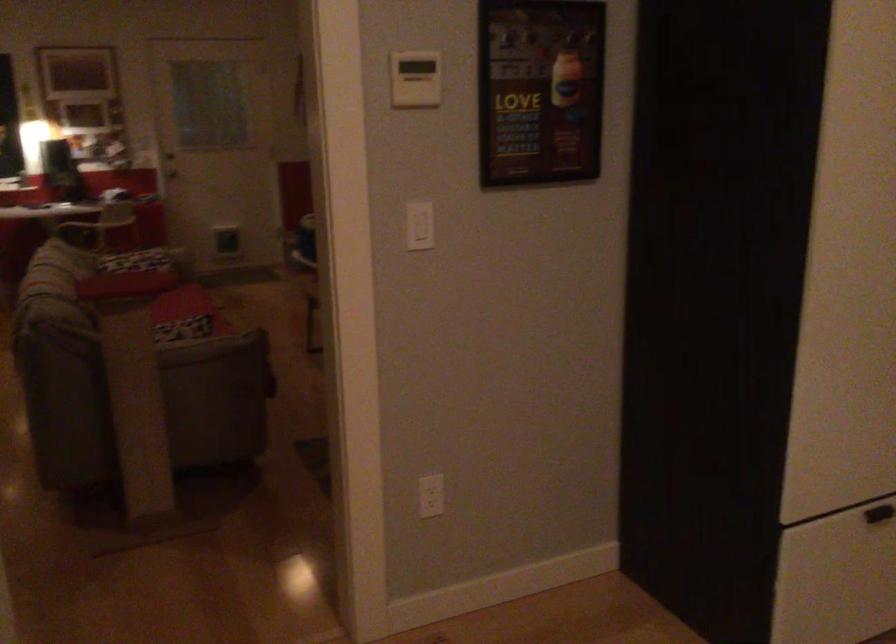
This screenshot has height=644, width=896. Find the location of `chair sitting surface`. chair sitting surface is located at coordinates (176, 308).